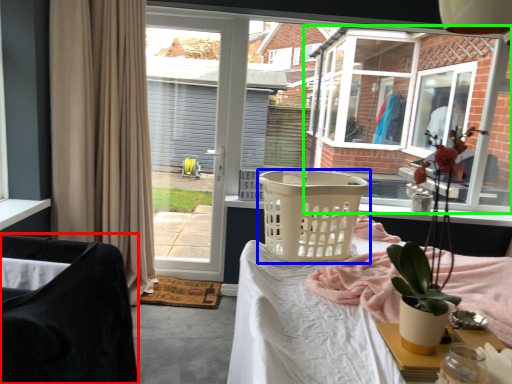
Question: Which object is positioned closest to chair (highlighted by a red box)? Select from basket (highlighted by a blue box) and window (highlighted by a green box).

Choices:
 (A) basket
 (B) window

Answer: (A)